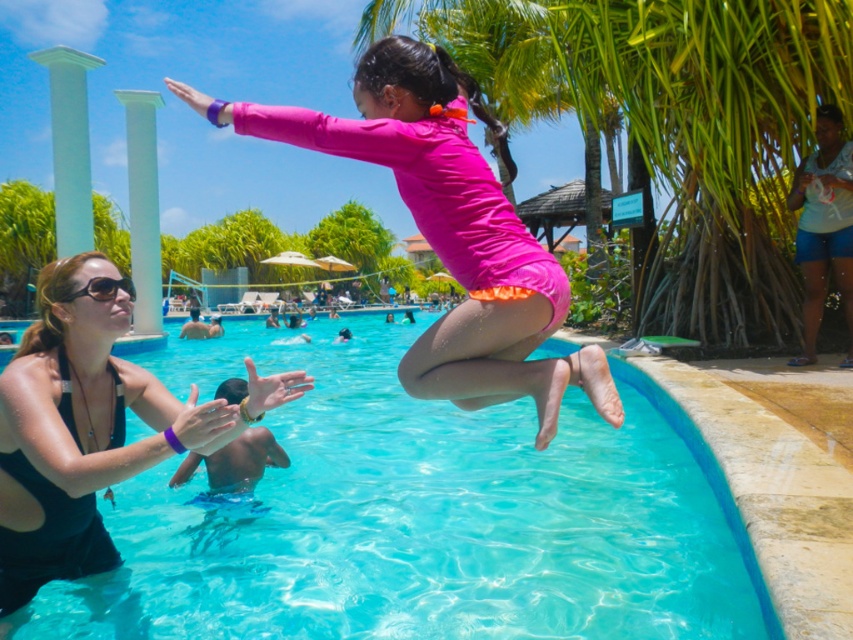
Question: Which object is the closest to the black plastic sunglasses at upper left?

Choices:
 (A) pink matte swimsuit at center
 (B) light blue denim shorts at right

Answer: (A)

Question: In this image, where is light blue denim shorts at right located relative to black plastic sunglasses at upper left?

Choices:
 (A) left
 (B) right

Answer: (B)

Question: Can you confirm if pink matte swimsuit at center is bigger than light blue denim shorts at right?

Choices:
 (A) no
 (B) yes

Answer: (B)

Question: Among these points, which one is farthest from the camera?

Choices:
 (A) (525, 253)
 (B) (589, 404)
 (C) (769, 26)
 (D) (850, 160)

Answer: (B)

Question: In this image, where is transparent blue water at center located relative to light blue denim shorts at right?

Choices:
 (A) above
 (B) below

Answer: (B)

Question: Estimate the real-world distances between objects in this image. Which object is farther from the black plastic sunglasses at upper left?

Choices:
 (A) black matte swimsuit at left
 (B) transparent blue water at center
 (C) light blue denim shorts at right
 (D) green leafy palm tree at upper center

Answer: (D)